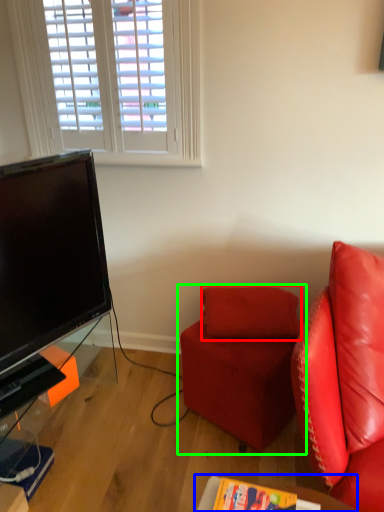
Question: Based on their relative distances, which object is farther from pillow (highlighted by a red box)? Choose from table (highlighted by a blue box) and studio couch (highlighted by a green box).

Choices:
 (A) table
 (B) studio couch

Answer: (A)